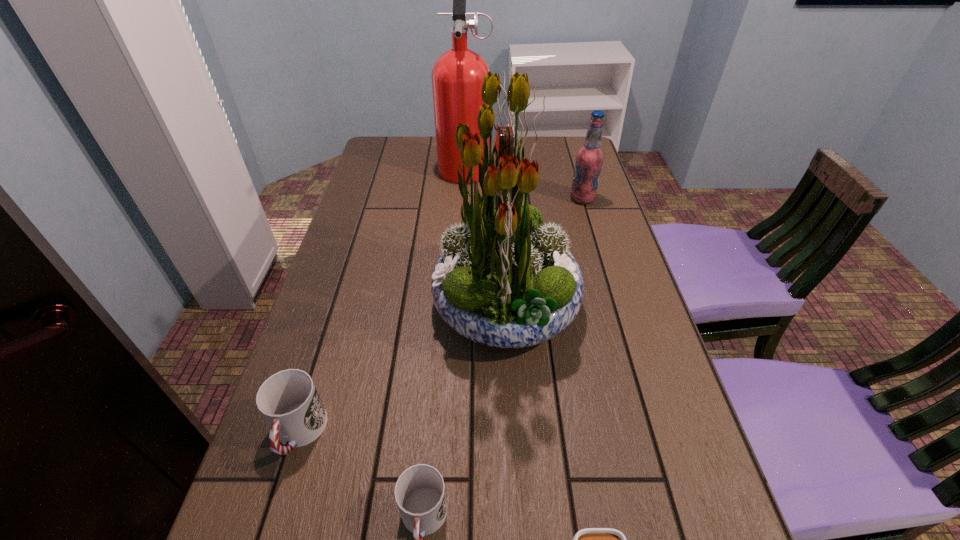
Locate an element on the screen. The width and height of the screenshot is (960, 540). the farthest object is located at coordinates (457, 76).

In order to click on flower arrangement in this screenshot , I will do `click(503, 280)`.

This screenshot has width=960, height=540. Identify the location of the fourth shortest object. (589, 159).

This screenshot has height=540, width=960. I want to click on the rightmost object, so click(589, 159).

This screenshot has width=960, height=540. In order to click on the tallest cup in this screenshot , I will do [x=288, y=400].

Find the location of `the leftmost cup`. the leftmost cup is located at coordinates (288, 400).

I want to click on free spot located on the left of the fire extinguisher, so click(419, 165).

Locate an element on the screen. vacant space located on the front-facing side of the flower arrangement is located at coordinates (404, 307).

At what (x,y) coordinates should I click in order to perform the action: click on vacant space located on the front-facing side of the flower arrangement. Please return your answer as a coordinate pair (x, y). The height and width of the screenshot is (540, 960). Looking at the image, I should click on (400, 307).

You are a GUI agent. You are given a task and a screenshot of the screen. Output one action in this format:
    pyautogui.click(x=<x>, y=<y>)
    Task: Click on the free space located on the front-facing side of the flower arrangement
    
    Given the screenshot: What is the action you would take?
    pyautogui.click(x=367, y=307)